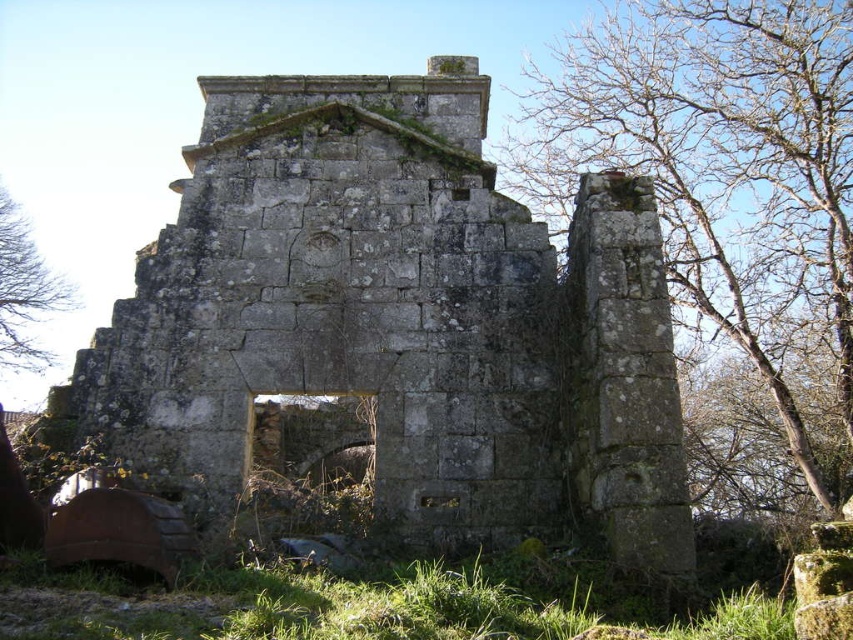
Is gray stone ruins at center thinner than green mossy stone wall at upper center?

Indeed, gray stone ruins at center has a lesser width compared to green mossy stone wall at upper center.

Can you confirm if gray stone ruins at center is wider than green mossy stone wall at upper center?

Incorrect, gray stone ruins at center's width does not surpass green mossy stone wall at upper center's.

The height and width of the screenshot is (640, 853). What do you see at coordinates (399, 321) in the screenshot? I see `gray stone ruins at center` at bounding box center [399, 321].

Identify the location of gray stone ruins at center. This screenshot has height=640, width=853. (399, 321).

Is gray stone ruins at center positioned behind brown wood tree at left?

No, it is in front of brown wood tree at left.

Can you confirm if gray stone ruins at center is positioned to the left of brown wood tree at left?

In fact, gray stone ruins at center is to the right of brown wood tree at left.

At what (x,y) coordinates should I click in order to perform the action: click on gray stone ruins at center. Please return your answer as a coordinate pair (x, y). The width and height of the screenshot is (853, 640). Looking at the image, I should click on (399, 321).

Does green mossy stone wall at upper center have a lesser height compared to brown wood tree at left?

No, green mossy stone wall at upper center is not shorter than brown wood tree at left.

Can you confirm if green mossy stone wall at upper center is positioned below brown wood tree at left?

No.

Looking at this image, measure the distance between point (630, 161) and camera.

Point (630, 161) and camera are 110.12 meters apart.

At what (x,y) coordinates should I click in order to perform the action: click on green mossy stone wall at upper center. Please return your answer as a coordinate pair (x, y). Looking at the image, I should click on (724, 180).